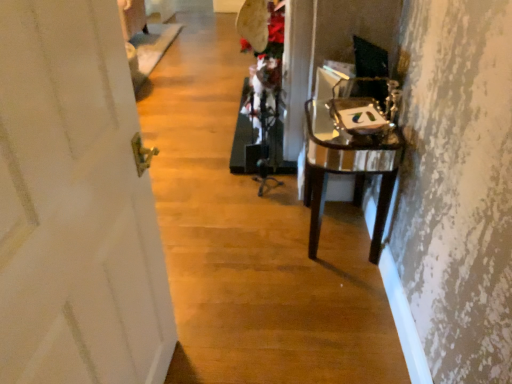
At what (x,y) coordinates should I click in order to perform the action: click on transparent glass table at right. Please return your answer as a coordinate pair (x, y). Looking at the image, I should click on (252, 241).

What do you see at coordinates (252, 241) in the screenshot? This screenshot has height=384, width=512. I see `transparent glass table at right` at bounding box center [252, 241].

Where is `transparent glass table at right`? transparent glass table at right is located at coordinates (252, 241).